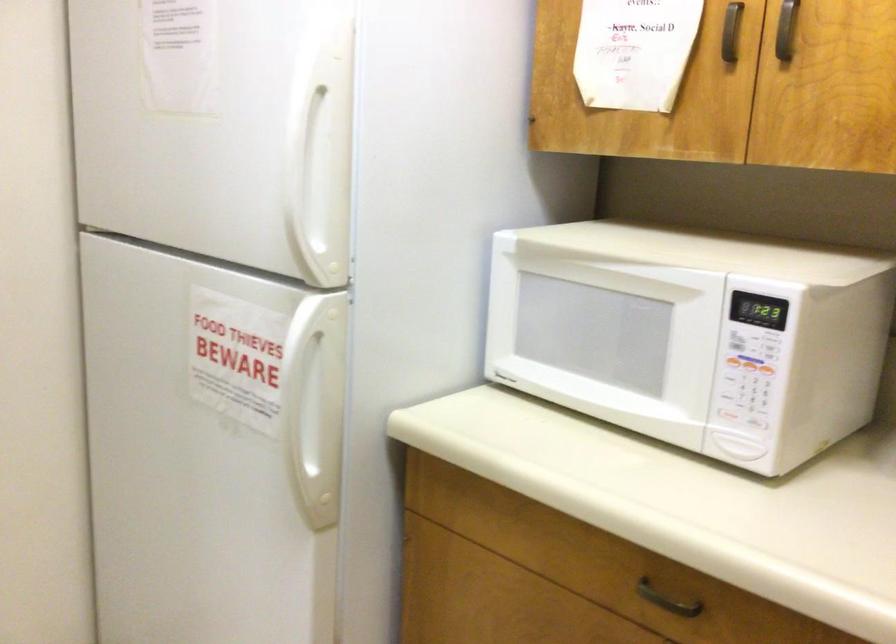
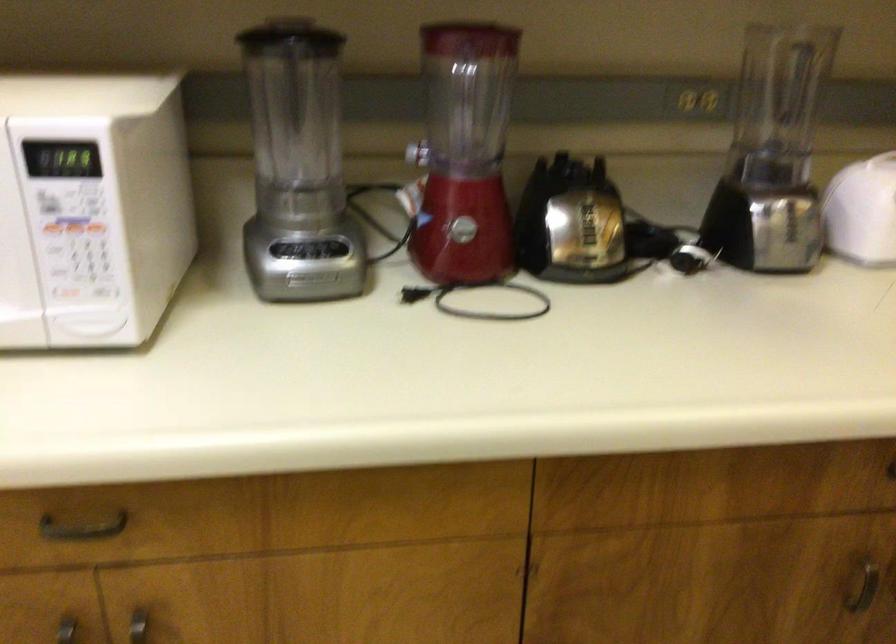
The point at (748, 375) is marked in the first image. Where is the corresponding point in the second image?

(74, 242)